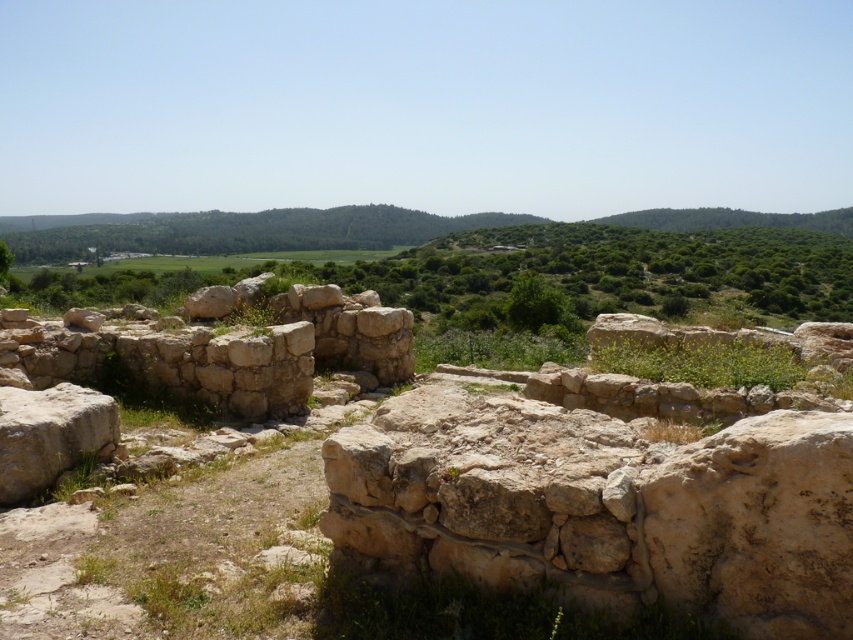
Question: Is light beige stone wall at center to the left of light brown stone boulder at lower left from the viewer's perspective?

Choices:
 (A) yes
 (B) no

Answer: (A)

Question: Is light beige stone wall at center further to camera compared to light brown stone boulder at lower left?

Choices:
 (A) no
 (B) yes

Answer: (B)

Question: Can you confirm if light beige stone wall at center is wider than light brown stone boulder at lower left?

Choices:
 (A) no
 (B) yes

Answer: (A)

Question: Which point appears closest to the camera in this image?

Choices:
 (A) [35, 323]
 (B) [80, 404]

Answer: (B)

Question: Which point appears farthest from the camera in this image?

Choices:
 (A) (82, 355)
 (B) (15, 396)

Answer: (A)